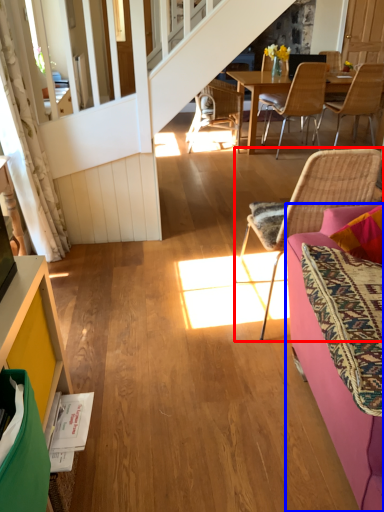
Question: Which object appears closest to the camera in this image, chair (highlighted by a red box) or studio couch (highlighted by a blue box)?

Choices:
 (A) chair
 (B) studio couch

Answer: (B)